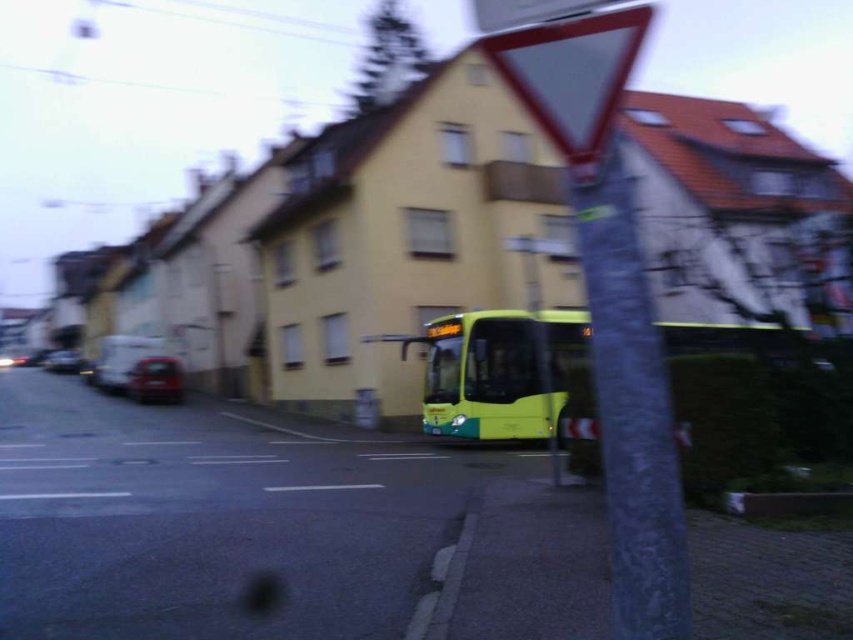
Question: Can you confirm if smooth gray pole at center is thinner than shiny black car at left?

Choices:
 (A) no
 (B) yes

Answer: (B)

Question: Which of the following is the closest to the observer?

Choices:
 (A) shiny red car at lower left
 (B) shiny black car at left
 (C) reflective glass triangle at upper center

Answer: (C)

Question: Considering the relative positions of smooth gray pole at center and green matte bus at center in the image provided, where is smooth gray pole at center located with respect to green matte bus at center?

Choices:
 (A) right
 (B) left

Answer: (B)

Question: Which point is closer to the camera?

Choices:
 (A) shiny red car at lower left
 (B) green matte bus at center

Answer: (B)

Question: Does smooth gray pole at center appear under shiny red car at lower left?

Choices:
 (A) yes
 (B) no

Answer: (B)

Question: Estimate the real-world distances between objects in this image. Which object is closer to the reflective glass triangle at upper center?

Choices:
 (A) green matte bus at center
 (B) shiny black car at left

Answer: (A)